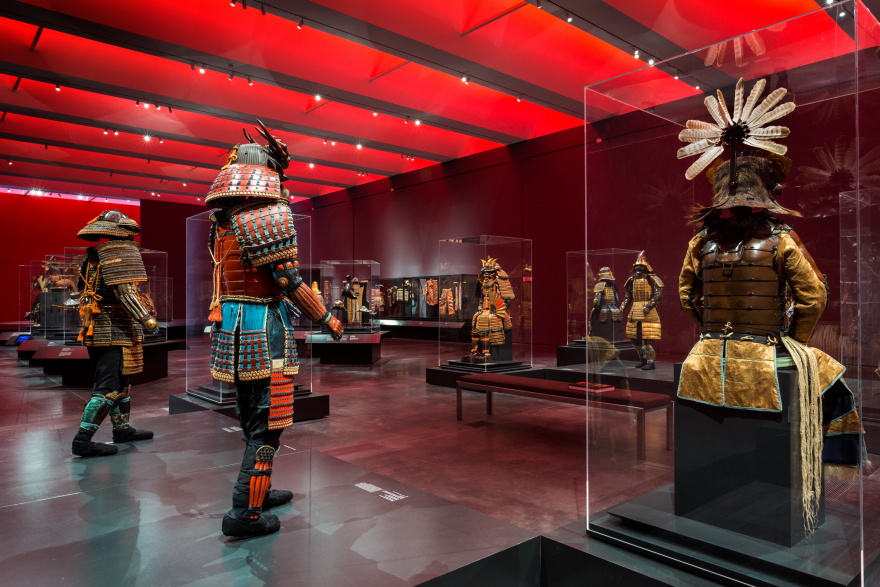
Locate an element on the screen. The height and width of the screenshot is (587, 880). wall is located at coordinates (69, 218), (534, 195).